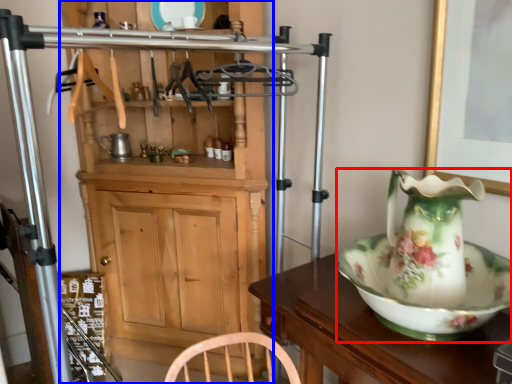
Question: Among these objects, which one is nearest to the camera, jug (highlighted by a red box) or cabinetry (highlighted by a blue box)?

Choices:
 (A) jug
 (B) cabinetry

Answer: (A)